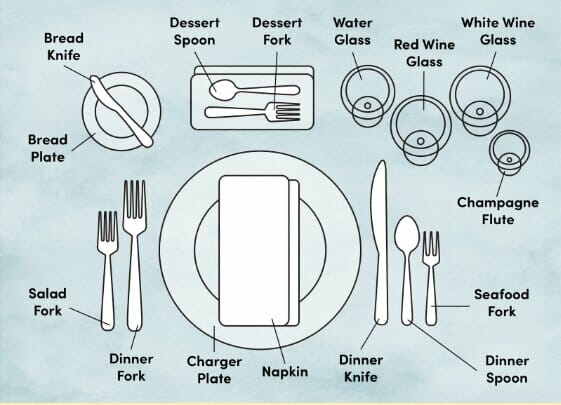
You are a GUI agent. You are given a task and a screenshot of the screen. Output one action in this format:
    pyautogui.click(x=<x>, y=<y>)
    Task: Click on the table to hold dinner items
    This screenshot has height=405, width=561.
    Given the screenshot: What is the action you would take?
    pyautogui.click(x=64, y=221), pyautogui.click(x=178, y=159), pyautogui.click(x=140, y=48), pyautogui.click(x=432, y=209), pyautogui.click(x=525, y=251), pyautogui.click(x=413, y=367), pyautogui.click(x=432, y=26)